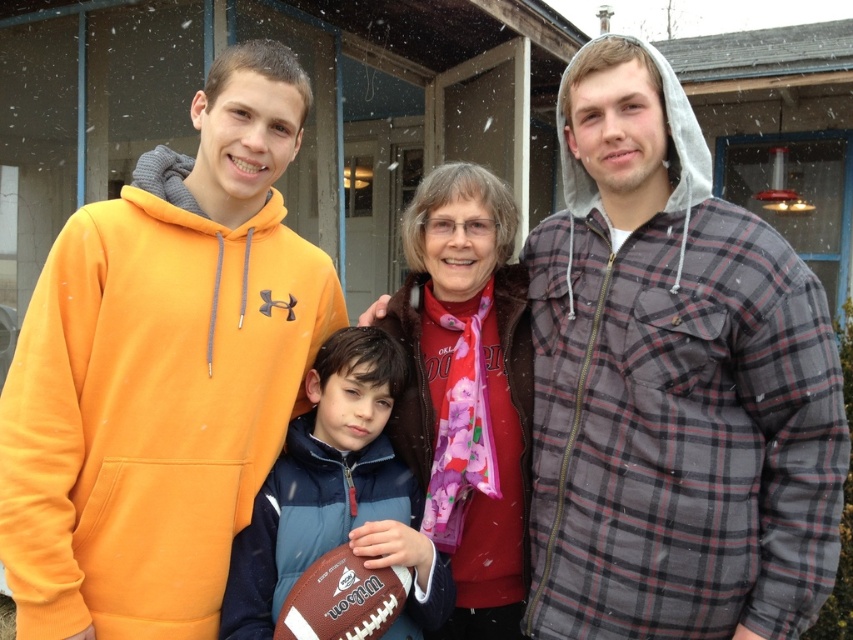
In the scene shown: You are standing in the snowy scene and want to place a small decoration between the two points labeled point (283, 150) and point (399, 557). Which point is closer to you where you should start placing the decoration?

Point (283, 150) is closer to you than point (399, 557), so you should start placing the decoration near point (283, 150) first.

You are organizing a winter clothing sale and need to display the plaid flannel shirt at right and orange fleece hoodie at left on a mannequin. Which item requires a larger mannequin to fit properly?

The orange fleece hoodie at left requires a larger mannequin because the plaid flannel shirt at right is narrower in width than the orange fleece hoodie at left.

Based on the photo, based on the scene description, where is the orange fleece hoodie at left located in the image?

The orange fleece hoodie at left is located at point (161, 371) in the image.